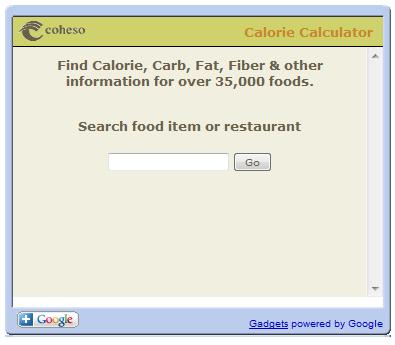
You are a GUI agent. You are given a task and a screenshot of the screen. Output one action in this format:
    pyautogui.click(x=<x>, y=<y>)
    Task: Click on the computer screen
    
    Given the screenshot: What is the action you would take?
    pyautogui.click(x=319, y=163)